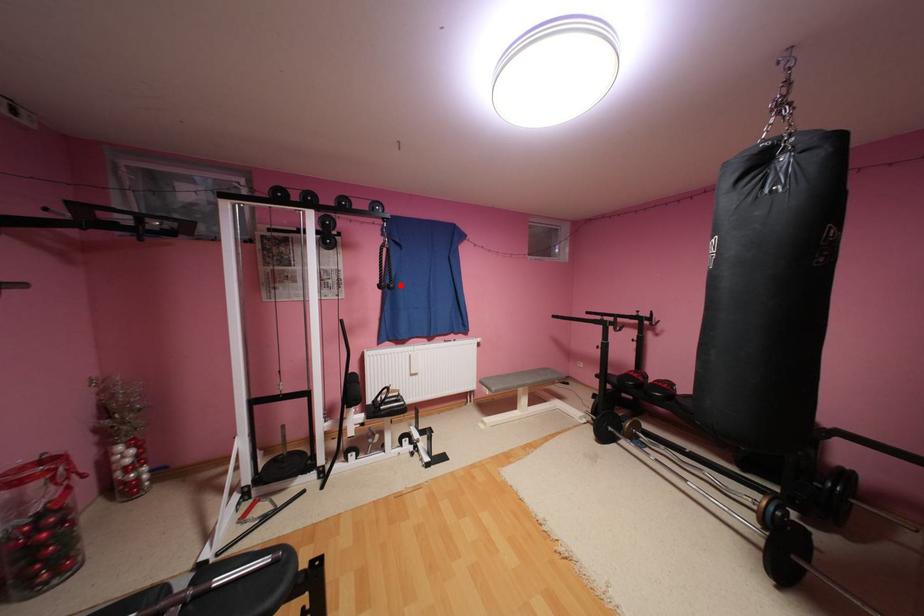
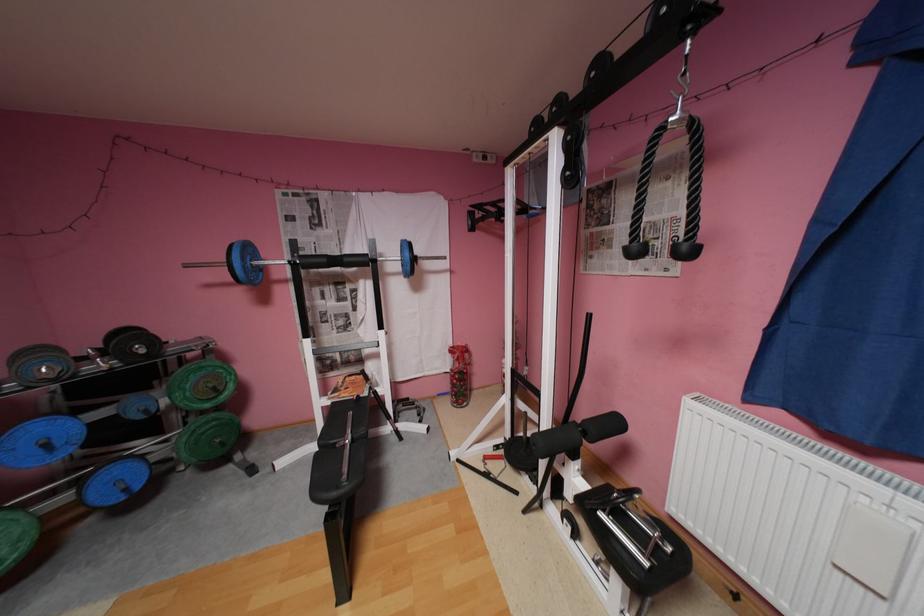
Question: A red point is marked in image1. In image2, is the corresponding 3D point closer to the camera or farther? Reply with the corresponding letter.

Choices:
 (A) The corresponding 3D point is closer.
 (B) The corresponding 3D point is farther.

Answer: (B)